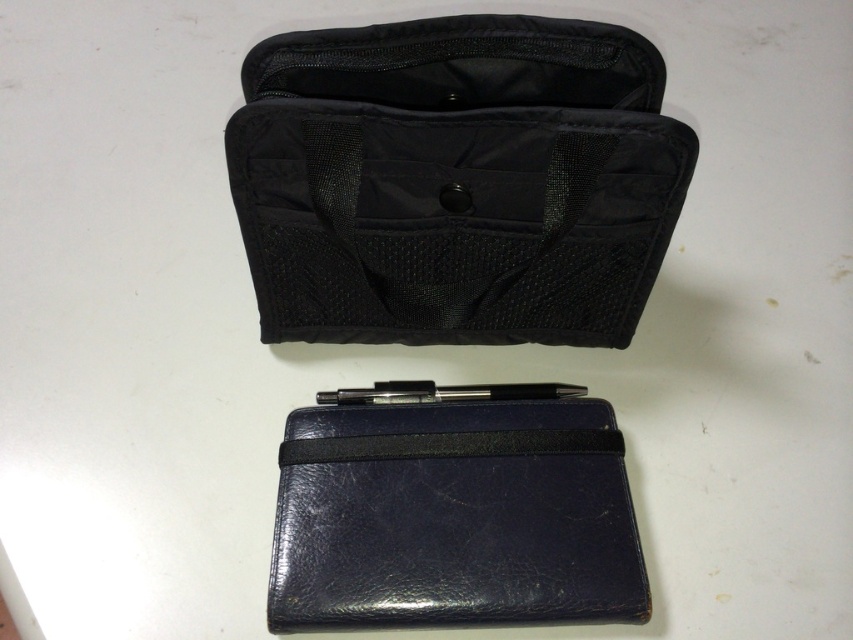
Does black fabric pouch at center have a greater height compared to navy leather pouch at center?

Yes, black fabric pouch at center is taller than navy leather pouch at center.

Is black fabric pouch at center closer to camera compared to navy leather pouch at center?

Yes, it is.

Does point (543, 300) come closer to viewer compared to point (527, 384)?

Yes, it is.

Locate an element on the screen. The image size is (853, 640). black fabric pouch at center is located at coordinates (456, 180).